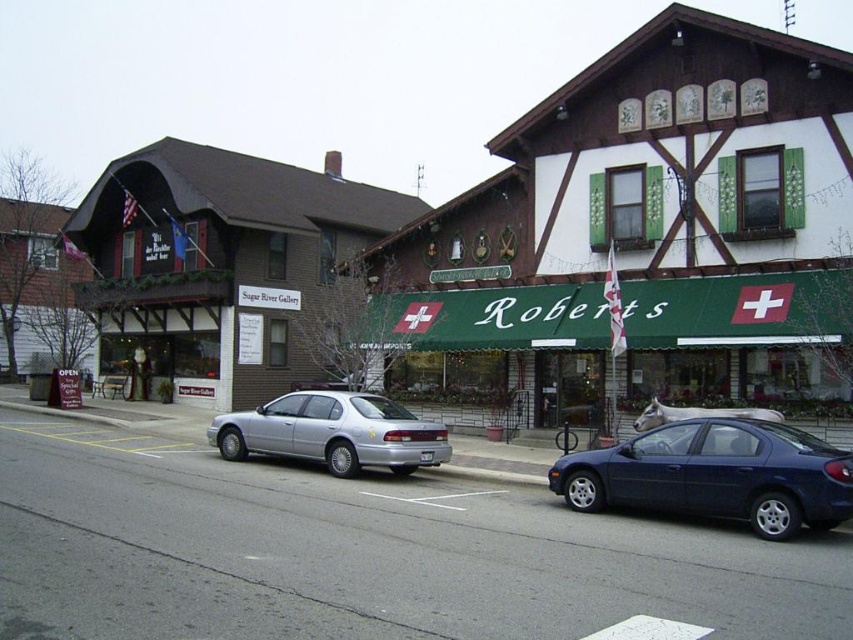
Who is shorter, green fabric awning at center or glossy blue sedan at lower right?

With less height is glossy blue sedan at lower right.

Which of these two, green fabric awning at center or glossy blue sedan at lower right, stands taller?

With more height is green fabric awning at center.

Consider the image. Who is more distant from viewer, (666, 385) or (793, 433)?

The point (666, 385) is behind.

The height and width of the screenshot is (640, 853). I want to click on green fabric awning at center, so click(x=734, y=326).

Does green fabric awning at center have a smaller size compared to silver metallic sedan at center?

No.

Locate an element on the screen. The height and width of the screenshot is (640, 853). green fabric awning at center is located at coordinates (734, 326).

This screenshot has height=640, width=853. In order to click on green fabric awning at center in this screenshot , I will do `click(734, 326)`.

Who is taller, brick sugar river gallery at left or silver metallic sedan at center?

Standing taller between the two is brick sugar river gallery at left.

In the scene shown: Who is higher up, brick sugar river gallery at left or silver metallic sedan at center?

brick sugar river gallery at left is higher up.

Between point (331, 184) and point (428, 442), which one is positioned in front?

Point (428, 442) is more forward.

This screenshot has width=853, height=640. I want to click on brick sugar river gallery at left, so click(x=222, y=262).